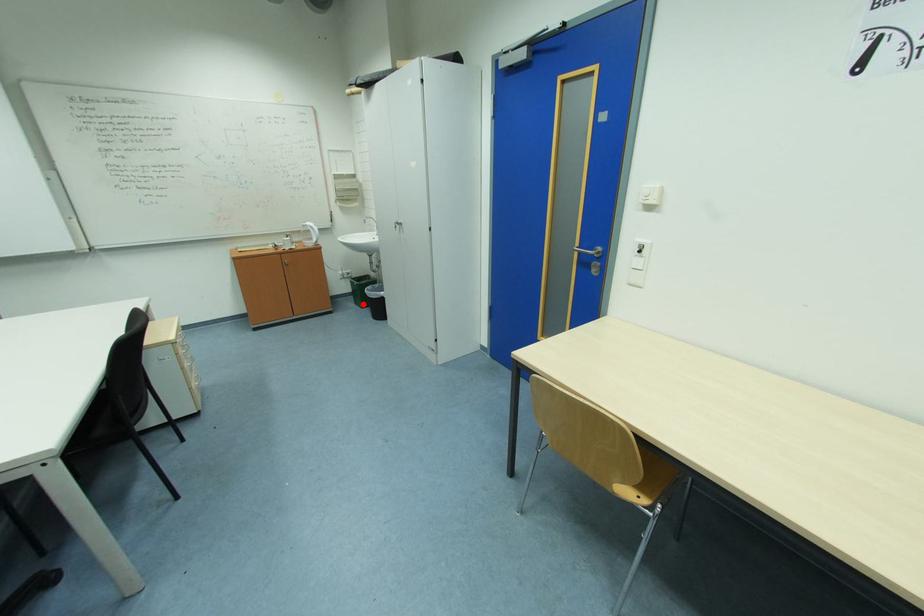
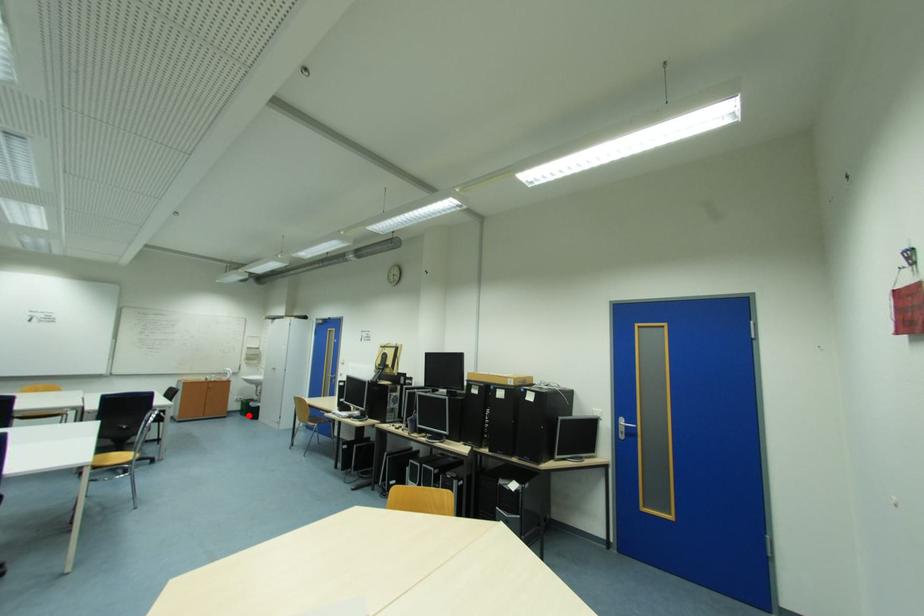
I am providing you with two images of the same scene from different viewpoints. A red point is marked on the first image and another point is marked on the second image. Is the red point in image1 aligned with the point shown in image2?

Yes